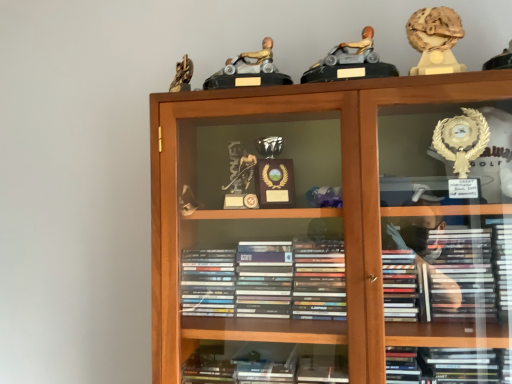
What do you see at coordinates (435, 40) in the screenshot? The image size is (512, 384). I see `gold marble statue at upper right, acting as the 3th toy starting from the left` at bounding box center [435, 40].

The width and height of the screenshot is (512, 384). What do you see at coordinates (342, 183) in the screenshot? I see `wooden bookcase at center` at bounding box center [342, 183].

What is the approximate height of gold metallic figure at upper center, which is counted as the 1th toy, starting from the left?

gold metallic figure at upper center, which is counted as the 1th toy, starting from the left, is 4.83 inches tall.

Image resolution: width=512 pixels, height=384 pixels. Find the location of `gold metallic figure at upper center, placed as the 3th toy when sorted from right to left`. gold metallic figure at upper center, placed as the 3th toy when sorted from right to left is located at coordinates (249, 70).

Image resolution: width=512 pixels, height=384 pixels. Find the location of `gold marble statue at upper right, acting as the 3th toy starting from the left`. gold marble statue at upper right, acting as the 3th toy starting from the left is located at coordinates (435, 40).

How many degrees apart are the facing directions of matte gray plastic toy car at upper center, the second toy in the left-to-right sequence, and gold marble statue at upper right, acting as the 3th toy starting from the left?

The angle between the facing direction of matte gray plastic toy car at upper center, the second toy in the left-to-right sequence, and the facing direction of gold marble statue at upper right, acting as the 3th toy starting from the left, is 4.16 degrees.

Which object is further away from the camera, matte gray plastic toy car at upper center, the second toy positioned from the right, or gold marble statue at upper right, acting as the 3th toy starting from the left?

gold marble statue at upper right, acting as the 3th toy starting from the left.

This screenshot has width=512, height=384. I want to click on toy on the right of the matte gray plastic toy car at upper center, the second toy in the left-to-right sequence, so click(435, 40).

In the scene shown: Who is smaller, matte gray plastic toy car at upper center, the second toy in the left-to-right sequence, or gold marble statue at upper right, acting as the 3th toy starting from the left?

gold marble statue at upper right, acting as the 3th toy starting from the left, is smaller.

Which of these two, gold marble statue at upper right, which is counted as the 1th toy, starting from the right, or matte gray plastic toy car at upper center, the second toy in the left-to-right sequence, is wider?

matte gray plastic toy car at upper center, the second toy in the left-to-right sequence.

From a real-world perspective, which object rests below the other?

matte gray plastic toy car at upper center, the second toy in the left-to-right sequence.

Which object is positioned more to the right, gold marble statue at upper right, which is counted as the 1th toy, starting from the right, or matte gray plastic toy car at upper center, the second toy positioned from the right?

Positioned to the right is gold marble statue at upper right, which is counted as the 1th toy, starting from the right.

Is gold marble statue at upper right, which is counted as the 1th toy, starting from the right, shorter than matte gray plastic toy car at upper center, the second toy positioned from the right?

No.

From a real-world perspective, is gold marble statue at upper right, acting as the 3th toy starting from the left, positioned over gold metallic figure at upper center, placed as the 3th toy when sorted from right to left, based on gravity?

Yes.

Is point (448, 32) more distant than point (268, 39)?

No.

Is gold marble statue at upper right, acting as the 3th toy starting from the left, looking in the opposite direction of gold metallic figure at upper center, placed as the 3th toy when sorted from right to left?

That's not correct — gold marble statue at upper right, acting as the 3th toy starting from the left, is not looking away from gold metallic figure at upper center, placed as the 3th toy when sorted from right to left.

This screenshot has width=512, height=384. I want to click on bookcase below the matte gray plastic toy car at upper center, the second toy in the left-to-right sequence (from a real-world perspective), so click(342, 183).

Considering their positions, is matte gray plastic toy car at upper center, the second toy positioned from the right, located in front of or behind wooden bookcase at center?

Visually, matte gray plastic toy car at upper center, the second toy positioned from the right, is located behind wooden bookcase at center.

Which of these two, matte gray plastic toy car at upper center, the second toy in the left-to-right sequence, or wooden bookcase at center, stands taller?

wooden bookcase at center is taller.

Considering the relative sizes of gold metallic figure at upper center, placed as the 3th toy when sorted from right to left, and wooden bookcase at center in the image provided, is gold metallic figure at upper center, placed as the 3th toy when sorted from right to left, wider than wooden bookcase at center?

No, gold metallic figure at upper center, placed as the 3th toy when sorted from right to left, is not wider than wooden bookcase at center.

Is wooden bookcase at center a part of gold metallic figure at upper center, which is counted as the 1th toy, starting from the left?

Definitely not — wooden bookcase at center is not inside gold metallic figure at upper center, which is counted as the 1th toy, starting from the left.

Which point is more distant from viewer, (248,68) or (162,195)?

The point (248,68) is behind.

In terms of height, does gold metallic figure at upper center, which is counted as the 1th toy, starting from the left, look taller or shorter compared to wooden bookcase at center?

Considering their sizes, gold metallic figure at upper center, which is counted as the 1th toy, starting from the left, has less height than wooden bookcase at center.

From a real-world perspective, is gold metallic figure at upper center, placed as the 3th toy when sorted from right to left, physically below matte gray plastic toy car at upper center, the second toy in the left-to-right sequence?

Indeed, from a real-world perspective, gold metallic figure at upper center, placed as the 3th toy when sorted from right to left, is positioned beneath matte gray plastic toy car at upper center, the second toy in the left-to-right sequence.

Based on the photo, between gold metallic figure at upper center, which is counted as the 1th toy, starting from the left, and matte gray plastic toy car at upper center, the second toy positioned from the right, which one has smaller width?

matte gray plastic toy car at upper center, the second toy positioned from the right.

Considering the points (245, 63) and (329, 74), which point is behind, point (245, 63) or point (329, 74)?

Positioned behind is point (245, 63).

In terms of height, does gold metallic figure at upper center, which is counted as the 1th toy, starting from the left, look taller or shorter compared to matte gray plastic toy car at upper center, the second toy positioned from the right?

In the image, gold metallic figure at upper center, which is counted as the 1th toy, starting from the left, appears to be shorter than matte gray plastic toy car at upper center, the second toy positioned from the right.

Considering the sizes of objects gold metallic figure at upper center, placed as the 3th toy when sorted from right to left, and gold marble statue at upper right, which is counted as the 1th toy, starting from the right, in the image provided, who is smaller, gold metallic figure at upper center, placed as the 3th toy when sorted from right to left, or gold marble statue at upper right, which is counted as the 1th toy, starting from the right,?

gold marble statue at upper right, which is counted as the 1th toy, starting from the right.

Is gold metallic figure at upper center, which is counted as the 1th toy, starting from the left, inside or outside of gold marble statue at upper right, acting as the 3th toy starting from the left?

gold metallic figure at upper center, which is counted as the 1th toy, starting from the left, cannot be found inside gold marble statue at upper right, acting as the 3th toy starting from the left.

From the image's perspective, is gold metallic figure at upper center, which is counted as the 1th toy, starting from the left, located above gold marble statue at upper right, acting as the 3th toy starting from the left?

No, from the image's perspective, gold metallic figure at upper center, which is counted as the 1th toy, starting from the left, is not above gold marble statue at upper right, acting as the 3th toy starting from the left.

Where is `toy located above the matte gray plastic toy car at upper center, the second toy in the left-to-right sequence (from a real-world perspective)`? The image size is (512, 384). toy located above the matte gray plastic toy car at upper center, the second toy in the left-to-right sequence (from a real-world perspective) is located at coordinates (435, 40).

There is a gold marble statue at upper right, acting as the 3th toy starting from the left. Where is `the 1st toy below it (from a real-world perspective)`? The width and height of the screenshot is (512, 384). the 1st toy below it (from a real-world perspective) is located at coordinates (350, 62).

Estimate the real-world distances between objects in this image. Which object is further from gold metallic figure at upper center, which is counted as the 1th toy, starting from the left, matte gray plastic toy car at upper center, the second toy in the left-to-right sequence, or wooden bookcase at center?

The object further to gold metallic figure at upper center, which is counted as the 1th toy, starting from the left, is wooden bookcase at center.

From the image, which object appears to be nearer to wooden bookcase at center, gold metallic figure at upper center, placed as the 3th toy when sorted from right to left, or matte gray plastic toy car at upper center, the second toy positioned from the right?

Based on the image, gold metallic figure at upper center, placed as the 3th toy when sorted from right to left, appears to be nearer to wooden bookcase at center.

Which object lies nearer to the anchor point gold marble statue at upper right, acting as the 3th toy starting from the left, gold metallic figure at upper center, placed as the 3th toy when sorted from right to left, or matte gray plastic toy car at upper center, the second toy positioned from the right?

matte gray plastic toy car at upper center, the second toy positioned from the right.

Looking at the image, which one is located further to matte gray plastic toy car at upper center, the second toy positioned from the right, wooden bookcase at center or gold marble statue at upper right, acting as the 3th toy starting from the left?

Among the two, wooden bookcase at center is located further to matte gray plastic toy car at upper center, the second toy positioned from the right.

When comparing their distances from wooden bookcase at center, does gold marble statue at upper right, acting as the 3th toy starting from the left, or matte gray plastic toy car at upper center, the second toy in the left-to-right sequence, seem closer?

Among the two, matte gray plastic toy car at upper center, the second toy in the left-to-right sequence, is located nearer to wooden bookcase at center.

When comparing their distances from wooden bookcase at center, does matte gray plastic toy car at upper center, the second toy in the left-to-right sequence, or gold metallic figure at upper center, placed as the 3th toy when sorted from right to left, seem further?

matte gray plastic toy car at upper center, the second toy in the left-to-right sequence.

From the picture: When comparing their distances from gold marble statue at upper right, which is counted as the 1th toy, starting from the right, does matte gray plastic toy car at upper center, the second toy in the left-to-right sequence, or gold metallic figure at upper center, placed as the 3th toy when sorted from right to left, seem closer?

Among the two, matte gray plastic toy car at upper center, the second toy in the left-to-right sequence, is located nearer to gold marble statue at upper right, which is counted as the 1th toy, starting from the right.

Looking at the image, which one is located closer to gold marble statue at upper right, which is counted as the 1th toy, starting from the right, gold metallic figure at upper center, which is counted as the 1th toy, starting from the left, or wooden bookcase at center?

gold metallic figure at upper center, which is counted as the 1th toy, starting from the left, lies closer to gold marble statue at upper right, which is counted as the 1th toy, starting from the right, than the other object.

Locate an element on the screen. The height and width of the screenshot is (384, 512). toy between matte gray plastic toy car at upper center, the second toy in the left-to-right sequence, and wooden bookcase at center from top to bottom is located at coordinates (249, 70).

Find the location of a particular element. This screenshot has height=384, width=512. toy between gold metallic figure at upper center, which is counted as the 1th toy, starting from the left, and gold marble statue at upper right, which is counted as the 1th toy, starting from the right, in the horizontal direction is located at coordinates (350, 62).